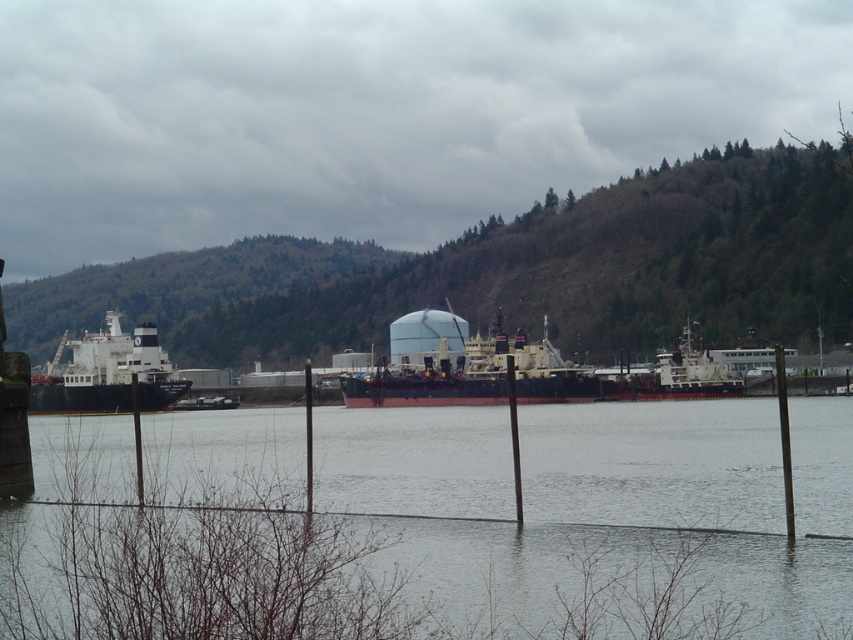
You are standing at the waterfront and want to know how far the point at coordinates (x=674, y=384) is from you. Can you determine the distance?

The point at coordinates (x=674, y=384) is 454.17 feet away from you.

You are a photographer positioned at the shoreline wanting to capture both the clear water at center and the white matte ship at left in a single shot. Based on their positions, which object should you frame first to ensure both are included in the photo?

The white matte ship at left should be framed first since the clear water at center is to the right of it, meaning the ship is closer to the left edge of the frame. Positioning the ship on the left side of the photo will allow the water to naturally extend to the right, ensuring both elements are captured.